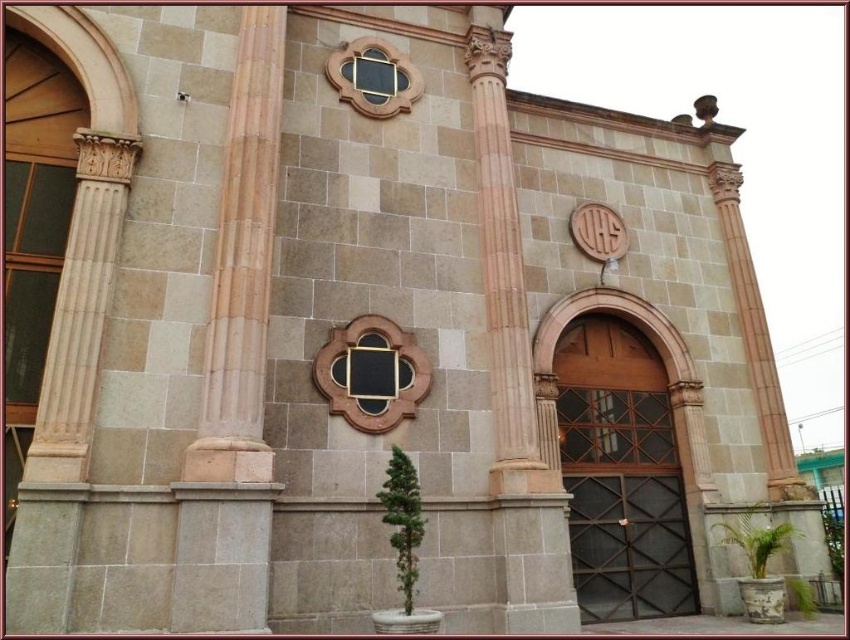
Locate an element on the screen. sandy stone column at left is located at coordinates (235, 364).

Who is more distant from viewer, [218,305] or [391,392]?

The point [391,392] is more distant.

Identify the location of sandy stone column at left. The image size is (850, 640). (235, 364).

Is point (258, 33) positioned behind point (395, 76)?

That is False.

Consider the image. Who is more distant from viewer, (252, 104) or (372, 109)?

The point (372, 109) is behind.

This screenshot has width=850, height=640. Identify the location of sandy stone column at left. (235, 364).

Is point (429, 365) less distant than point (411, 90)?

That is True.

Who is shorter, black matte window at center or matte gold window at upper center?

With less height is matte gold window at upper center.

Between point (404, 348) and point (357, 38), which one is positioned in front?

Point (404, 348) is more forward.

At what (x,y) coordinates should I click in order to perform the action: click on black matte window at center. Please return your answer as a coordinate pair (x, y). Looking at the image, I should click on (371, 372).